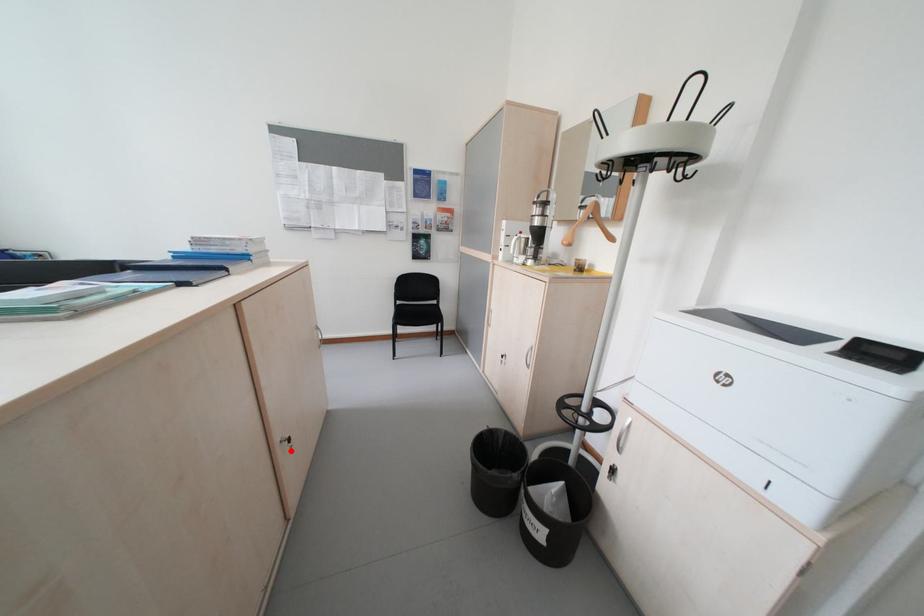
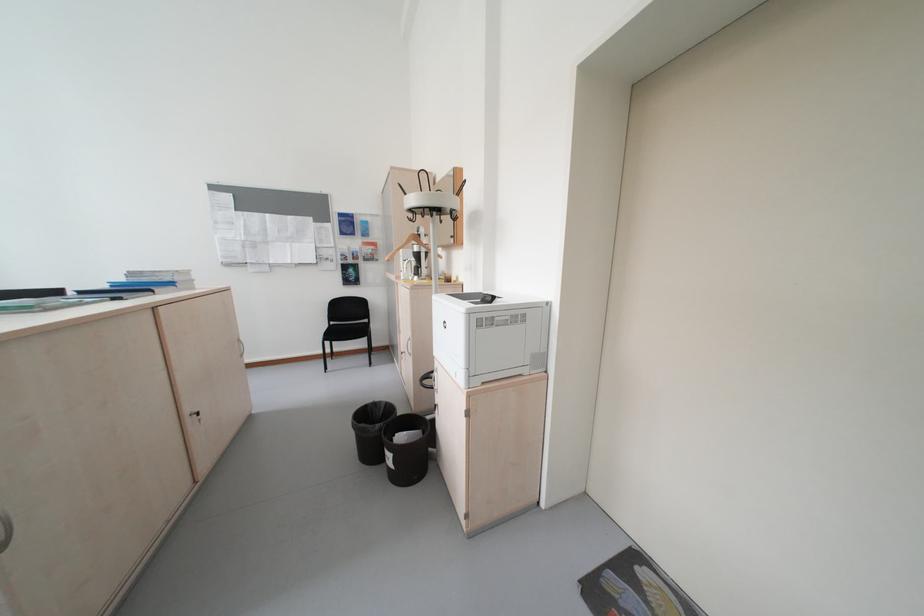
Where in the second image is the point corresponding to the highlighted location from the first image?

(200, 421)